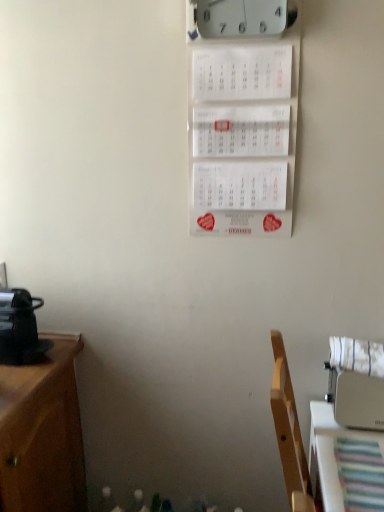
Question: Is white plastic clock at upper center bigger than white fabric chair at right?

Choices:
 (A) no
 (B) yes

Answer: (A)

Question: Can you confirm if white plastic clock at upper center is thinner than white fabric chair at right?

Choices:
 (A) no
 (B) yes

Answer: (B)

Question: From the image's perspective, is white plastic clock at upper center above white fabric chair at right?

Choices:
 (A) no
 (B) yes

Answer: (B)

Question: Can we say white plastic clock at upper center lies outside white fabric chair at right?

Choices:
 (A) yes
 (B) no

Answer: (A)

Question: Is white plastic clock at upper center at the right side of white fabric chair at right?

Choices:
 (A) yes
 (B) no

Answer: (B)

Question: Is the depth of white plastic clock at upper center less than that of white fabric chair at right?

Choices:
 (A) no
 (B) yes

Answer: (A)

Question: Can you confirm if white fabric chair at right is thinner than white plastic clock at upper center?

Choices:
 (A) no
 (B) yes

Answer: (A)

Question: Is white fabric chair at right not within white plastic clock at upper center?

Choices:
 (A) no
 (B) yes

Answer: (B)

Question: Considering the relative positions of white fabric chair at right and white plastic clock at upper center in the image provided, is white fabric chair at right in front of white plastic clock at upper center?

Choices:
 (A) yes
 (B) no

Answer: (A)

Question: Considering the relative sizes of white fabric chair at right and white plastic clock at upper center in the image provided, is white fabric chair at right shorter than white plastic clock at upper center?

Choices:
 (A) no
 (B) yes

Answer: (A)

Question: Can you confirm if white fabric chair at right is bigger than white plastic clock at upper center?

Choices:
 (A) yes
 (B) no

Answer: (A)

Question: Is white fabric chair at right not close to white plastic clock at upper center?

Choices:
 (A) no
 (B) yes

Answer: (B)

Question: Considering the positions of white fabric chair at right and white plastic clock at upper center in the image, is white fabric chair at right wider or thinner than white plastic clock at upper center?

Choices:
 (A) wide
 (B) thin

Answer: (A)